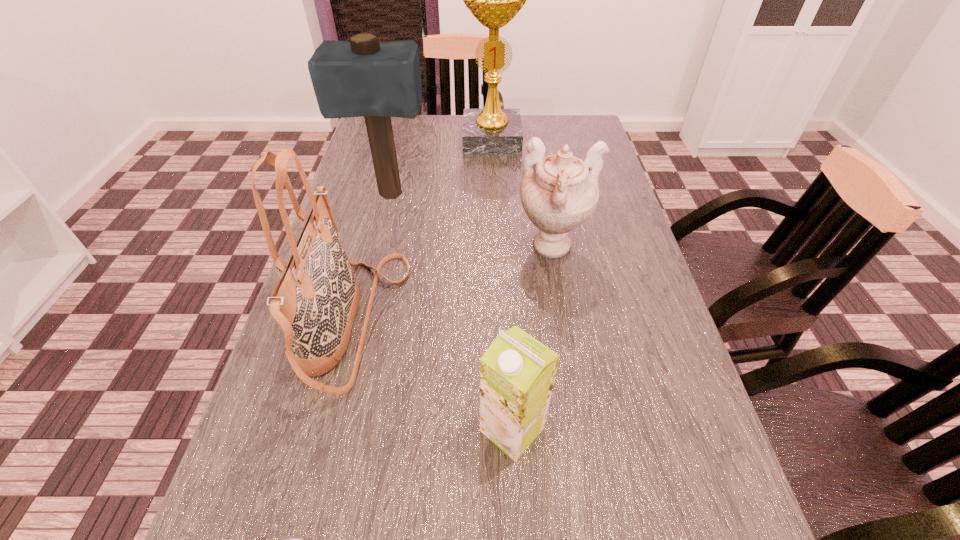
In order to click on free space that satisfies the following two spatial constraints: 1. on the front side of the mallet; 2. on the left side of the soya milk in this screenshot , I will do `click(333, 429)`.

The width and height of the screenshot is (960, 540). Identify the location of vacant space that satisfies the following two spatial constraints: 1. on the front-facing side of the farthest object; 2. on the front-facing side of the handbag. (498, 323).